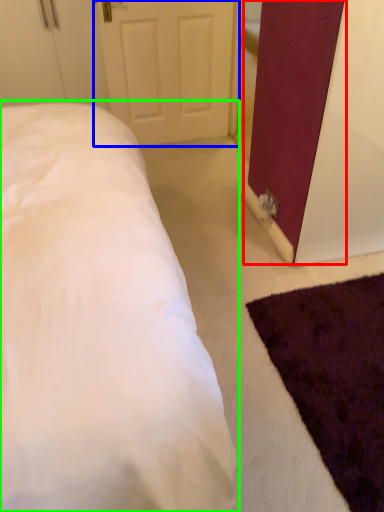
Question: Considering the real-world distances, which object is closest to barn door (highlighted by a red box)? door (highlighted by a blue box) or bed (highlighted by a green box).

Choices:
 (A) door
 (B) bed

Answer: (B)